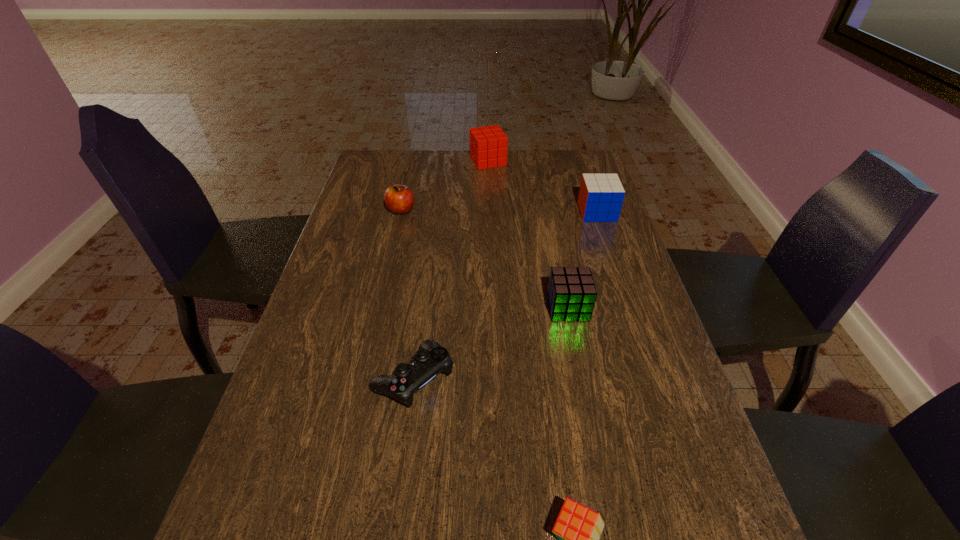
Find the location of `the leftmost cube`. the leftmost cube is located at coordinates (488, 145).

At what (x,y) coordinates should I click in order to perform the action: click on the farthest object. Please return your answer as a coordinate pair (x, y). This screenshot has width=960, height=540. Looking at the image, I should click on (488, 145).

Locate an element on the screen. The width and height of the screenshot is (960, 540). the third nearest cube is located at coordinates (600, 199).

Where is `the rightmost object`? The width and height of the screenshot is (960, 540). the rightmost object is located at coordinates (600, 199).

Locate an element on the screen. Image resolution: width=960 pixels, height=540 pixels. the fourth farthest object is located at coordinates 571,293.

The width and height of the screenshot is (960, 540). What are the coordinates of `apple` in the screenshot? It's located at 399,199.

Where is `the fifth farthest object`? This screenshot has height=540, width=960. the fifth farthest object is located at coordinates (431, 359).

Where is `vacant region located on the right of the farthest cube`? vacant region located on the right of the farthest cube is located at coordinates (579, 161).

Image resolution: width=960 pixels, height=540 pixels. In order to click on free space located on the front of the rightmost cube in this screenshot , I will do `click(624, 293)`.

You are a GUI agent. You are given a task and a screenshot of the screen. Output one action in this format:
    pyautogui.click(x=<x>, y=<y>)
    Task: Click on the vacant space situated 0.090m on the right of the third nearest object
    This screenshot has width=960, height=540.
    Given the screenshot: What is the action you would take?
    pyautogui.click(x=623, y=307)